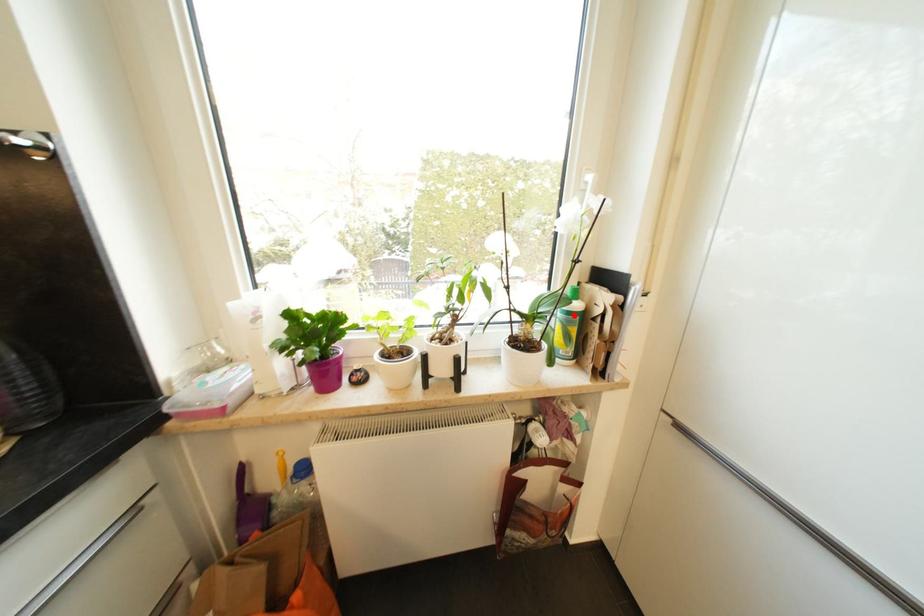
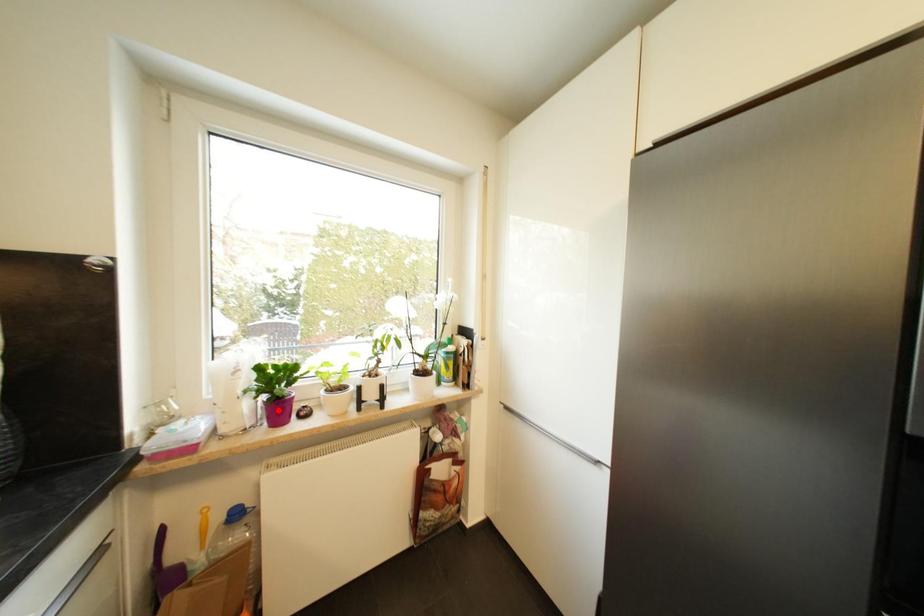
I am providing you with two images of the same scene from different viewpoints. A red point is marked on the first image and another point is marked on the second image. Is the red point in image1 aligned with the point shown in image2?

No